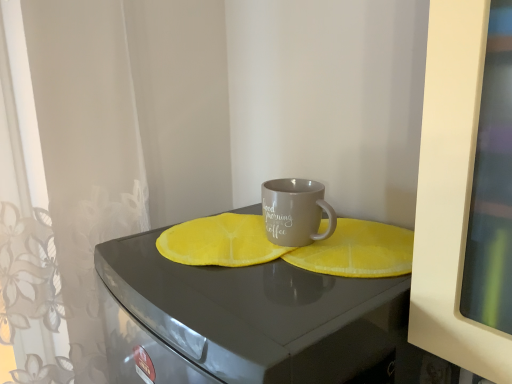
Question: Should I look upward or downward to see matte gray table at center?

Choices:
 (A) down
 (B) up

Answer: (A)

Question: Can you confirm if matte gray table at center is thinner than matte gray mug at center?

Choices:
 (A) no
 (B) yes

Answer: (A)

Question: Is matte gray table at center aimed at matte gray mug at center?

Choices:
 (A) no
 (B) yes

Answer: (A)

Question: Considering the relative sizes of matte gray table at center and matte gray mug at center in the image provided, is matte gray table at center taller than matte gray mug at center?

Choices:
 (A) no
 (B) yes

Answer: (B)

Question: Is matte gray table at center shorter than matte gray mug at center?

Choices:
 (A) yes
 (B) no

Answer: (B)

Question: Does matte gray table at center appear on the left side of matte gray mug at center?

Choices:
 (A) yes
 (B) no

Answer: (A)

Question: Is matte gray mug at center located within matte gray table at center?

Choices:
 (A) yes
 (B) no

Answer: (B)

Question: Is matte gray mug at center directly adjacent to matte gray table at center?

Choices:
 (A) no
 (B) yes

Answer: (A)

Question: Can you confirm if matte gray mug at center is taller than matte gray table at center?

Choices:
 (A) no
 (B) yes

Answer: (A)

Question: Is matte gray mug at center wider than matte gray table at center?

Choices:
 (A) yes
 (B) no

Answer: (B)

Question: Can you confirm if matte gray mug at center is positioned to the left of matte gray table at center?

Choices:
 (A) yes
 (B) no

Answer: (B)

Question: From the image's perspective, does matte gray mug at center appear higher than matte gray table at center?

Choices:
 (A) no
 (B) yes

Answer: (B)

Question: Is matte gray mug at center behind matte gray table at center?

Choices:
 (A) yes
 (B) no

Answer: (A)

Question: Is matte gray table at center inside or outside of matte gray mug at center?

Choices:
 (A) outside
 (B) inside

Answer: (A)